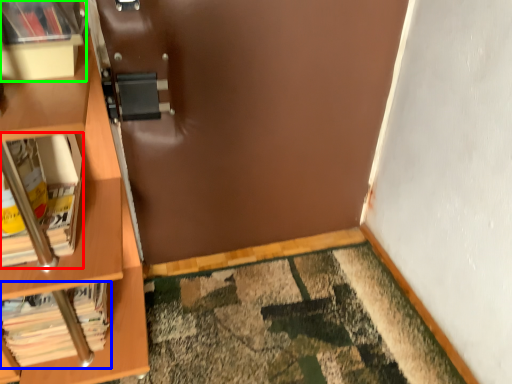
Question: Estimate the real-world distances between objects in this image. Which object is closer to book (highlighted by a red box), book (highlighted by a blue box) or shelf (highlighted by a green box)?

Choices:
 (A) book
 (B) shelf

Answer: (B)